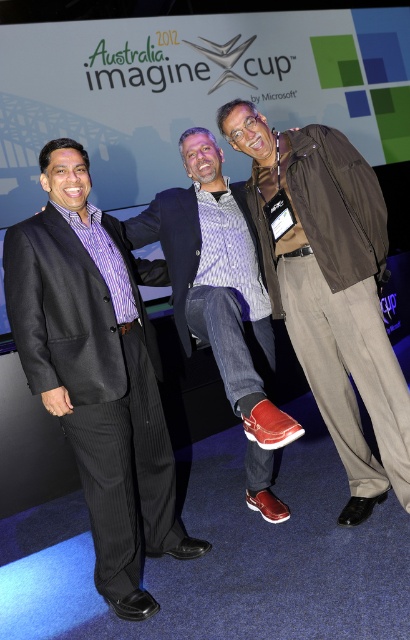
Question: Which point is closer to the camera?

Choices:
 (A) black pinstripe suit at left
 (B) matte black blazer at left

Answer: (B)

Question: Is brown leather jacket at center positioned behind matte black blazer at center?

Choices:
 (A) no
 (B) yes

Answer: (B)

Question: Does brown leather jacket at center appear over black pinstripe suit at left?

Choices:
 (A) yes
 (B) no

Answer: (A)

Question: Is black pinstripe suit at left thinner than matte black blazer at center?

Choices:
 (A) yes
 (B) no

Answer: (A)

Question: Which of these objects is positioned closest to the black pinstripe suit at left?

Choices:
 (A) brown leather jacket at center
 (B) matte black blazer at center

Answer: (B)

Question: Which point is closer to the camera?

Choices:
 (A) (303, 156)
 (B) (141, 312)

Answer: (A)